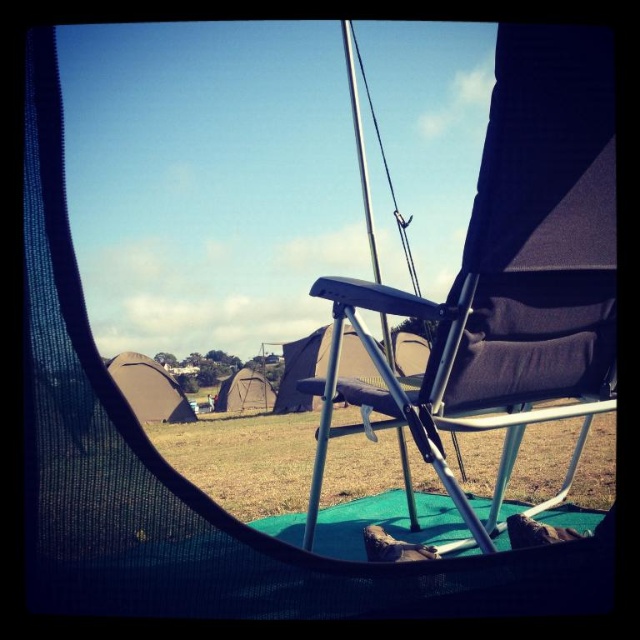
Question: Which object is the closest to the brown canvas tent at center?

Choices:
 (A) dark blue fabric beach chair at center
 (B) dark gray canvas tent at center

Answer: (B)

Question: Is brown canvas tent at center above dark gray canvas tent at center?

Choices:
 (A) no
 (B) yes

Answer: (B)

Question: Observing the image, what is the correct spatial positioning of brown canvas tent at center in reference to dark gray canvas tent at center?

Choices:
 (A) left
 (B) right

Answer: (A)

Question: Which point is closer to the camera?

Choices:
 (A) dark blue fabric beach chair at center
 (B) brown canvas tent at center

Answer: (A)

Question: Based on their relative distances, which object is farther from the dark blue fabric beach chair at center?

Choices:
 (A) dark gray canvas tent at center
 (B) brown canvas tent at center

Answer: (A)

Question: Observing the image, what is the correct spatial positioning of dark blue fabric beach chair at center in reference to brown canvas tent at center?

Choices:
 (A) above
 (B) below

Answer: (A)